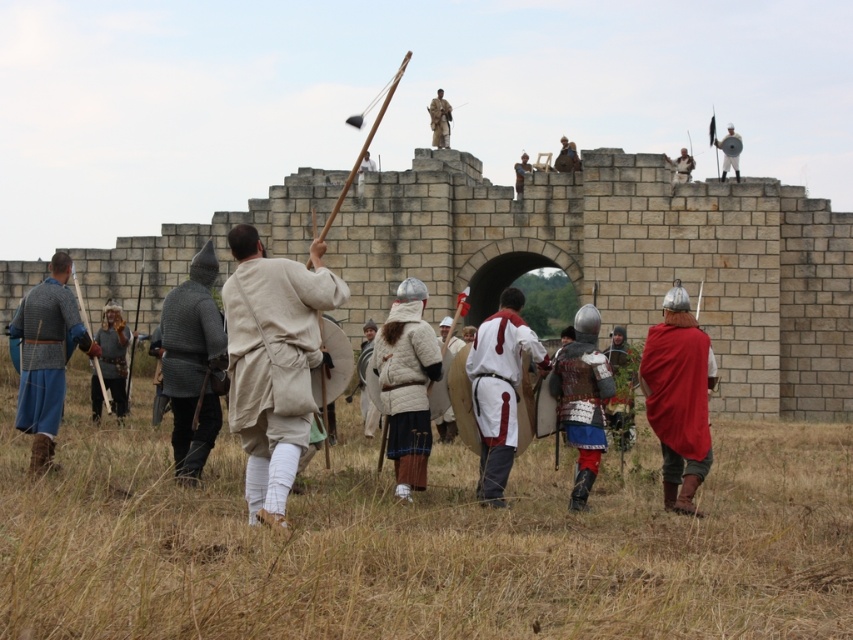
Between chainmail armor at center and brown leather armor at upper center, which one is positioned higher?

brown leather armor at upper center is above.

Is point (216, 324) behind point (432, 145)?

No, (216, 324) is closer to viewer.

Does point (202, 342) come farther from viewer compared to point (437, 90)?

No, it is not.

Find the location of a particular element. The height and width of the screenshot is (640, 853). chainmail armor at center is located at coordinates (193, 364).

Does white leather tunic at center have a greater width compared to brown leather armor at upper center?

Yes, white leather tunic at center is wider than brown leather armor at upper center.

This screenshot has height=640, width=853. Identify the location of white leather tunic at center. (498, 388).

At what (x,y) coordinates should I click in order to perform the action: click on white leather tunic at center. Please return your answer as a coordinate pair (x, y). The image size is (853, 640). Looking at the image, I should click on (498, 388).

Does point (490, 444) lie behind point (107, 324)?

No, (490, 444) is in front of (107, 324).

Does point (508, 428) come in front of point (111, 372)?

Yes.

You are a GUI agent. You are given a task and a screenshot of the screen. Output one action in this format:
    pyautogui.click(x=<x>, y=<y>)
    Task: Click on the white leather tunic at center
    The height and width of the screenshot is (640, 853).
    Given the screenshot: What is the action you would take?
    pyautogui.click(x=498, y=388)